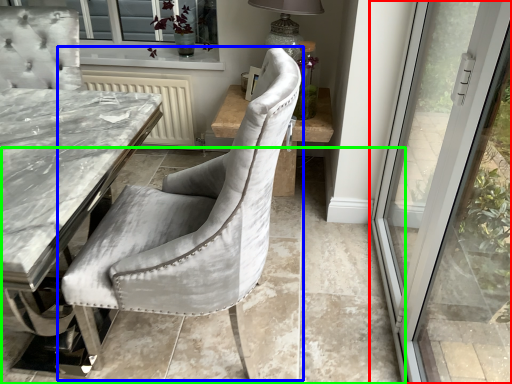
Question: Based on their relative distances, which object is nearer to door (highlighted by a red box)? Choose from chair (highlighted by a blue box) and concrete (highlighted by a green box).

Choices:
 (A) chair
 (B) concrete

Answer: (B)